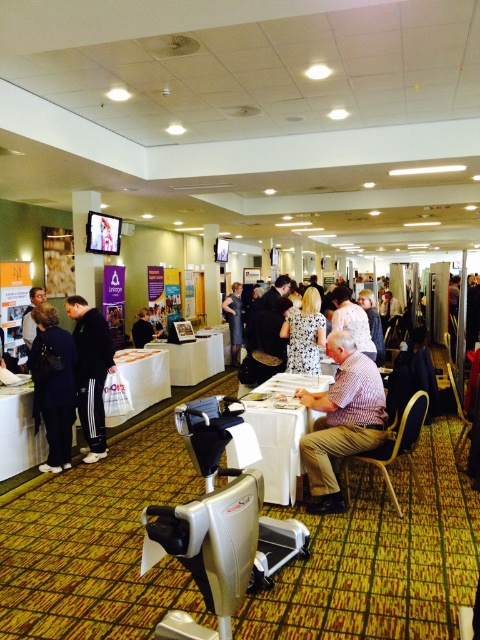
You are organizing a small meeting for 4 people. The white fabric table at center and dark brown fur coat at left are in the way. Which object should you move to free up more space?

The white fabric table at center is bigger than the dark brown fur coat at left, so you should move the white fabric table at center to free up more space.

You are organizing a small presentation at the event and need to place a laptop on the plaid shirt at center or the white fabric table at center. Which surface would allow more space for additional items alongside the laptop?

The white fabric table at center allows more space for additional items alongside the laptop because it occupies more space than the plaid shirt at center.